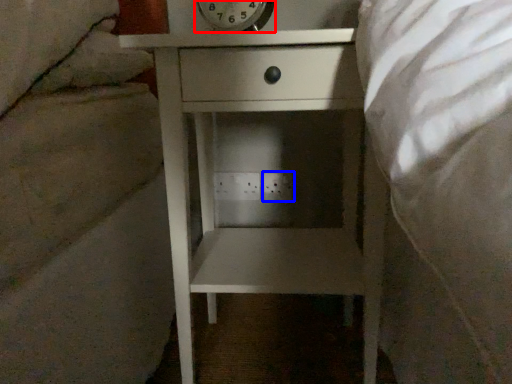
Question: Which object is further to the camera taking this photo, alarm clock (highlighted by a red box) or electric outlet (highlighted by a blue box)?

Choices:
 (A) alarm clock
 (B) electric outlet

Answer: (B)